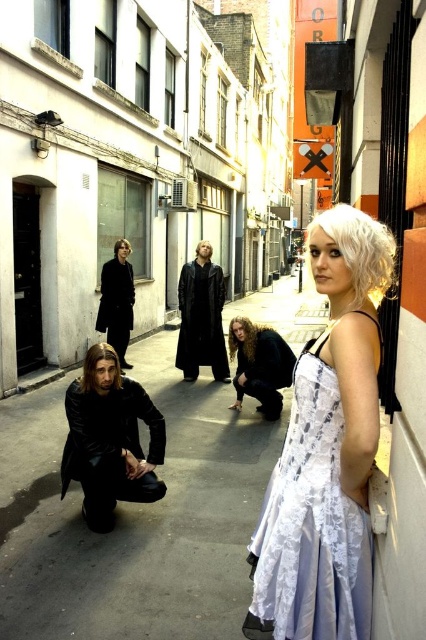
Question: Which of these objects is positioned closest to the dark gray woolen robe at center?

Choices:
 (A) white curly wig at right
 (B) leather coat at center
 (C) white lace dress at center

Answer: (B)

Question: Where is black leather jacket at lower left located in relation to blonde hair at center in the image?

Choices:
 (A) below
 (B) above

Answer: (A)

Question: Can you confirm if white curly wig at right is wider than dark gray woolen robe at center?

Choices:
 (A) yes
 (B) no

Answer: (B)

Question: Estimate the real-world distances between objects in this image. Which object is closer to the black leather jacket at lower left?

Choices:
 (A) black matte robe at center
 (B) black leather robe at lower left
 (C) leather coat at center
 (D) white curly wig at right

Answer: (B)

Question: Which point appears closest to the camera in this image?

Choices:
 (A) (39, 392)
 (B) (121, 284)
 (C) (253, 358)

Answer: (C)

Question: Does white curly wig at right come behind dark brown silky hair at lower left?

Choices:
 (A) no
 (B) yes

Answer: (A)